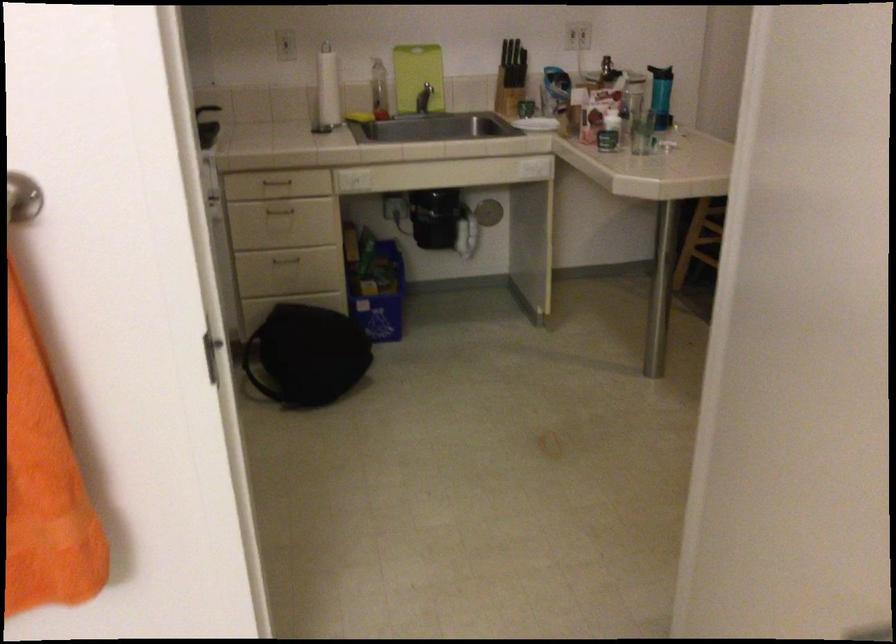
This screenshot has height=644, width=896. What do you see at coordinates (424, 98) in the screenshot?
I see `a faucet handle` at bounding box center [424, 98].